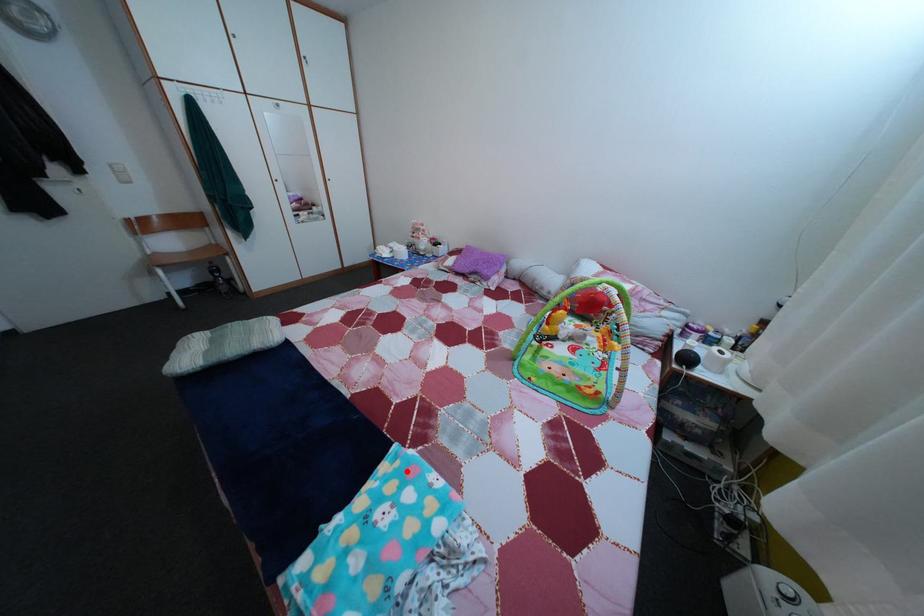
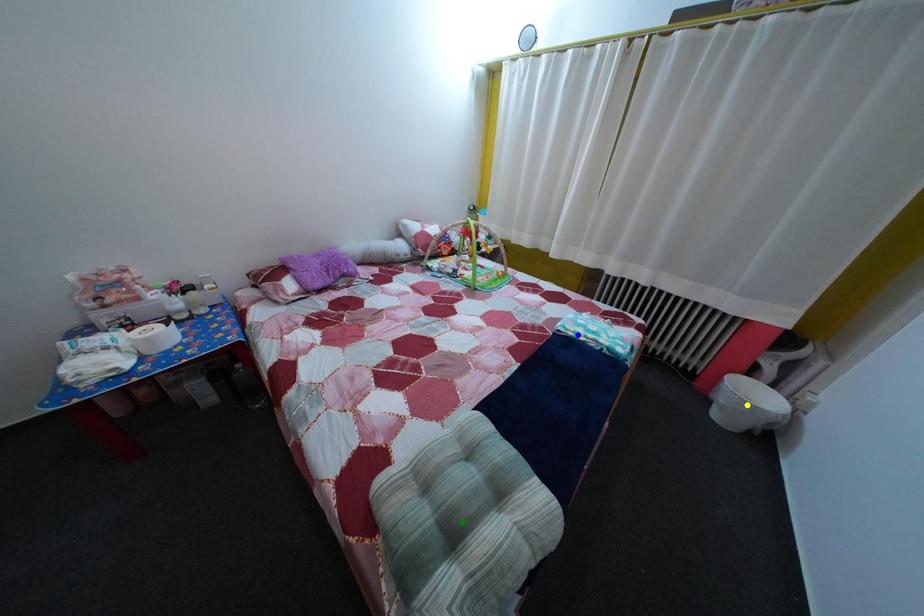
Question: I am providing you with two images of the same scene from different viewpoints. A red point is marked on the first image. You are given multiple points on the second image. Which mark in image 2 goes with the point in image 1?

Choices:
 (A) blue point
 (B) green point
 (C) yellow point

Answer: (A)